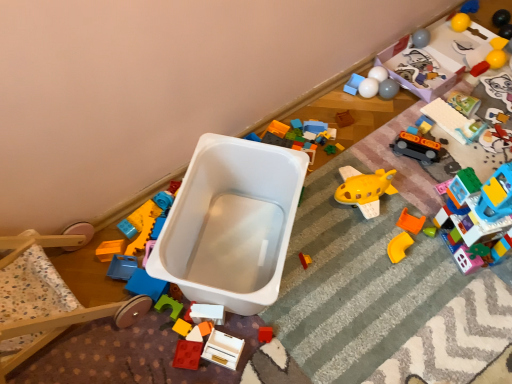
At what (x,y) coordinates should I click in order to perform the action: click on vacant space in between orange matte plastic corner piece at lower right, the ninth toy positioned from the right, and orange plastic train at center, which ranks as the sixth toy in right-to-left order. Please return your answer as a coordinate pair (x, y). This screenshot has height=384, width=512. Looking at the image, I should click on (406, 196).